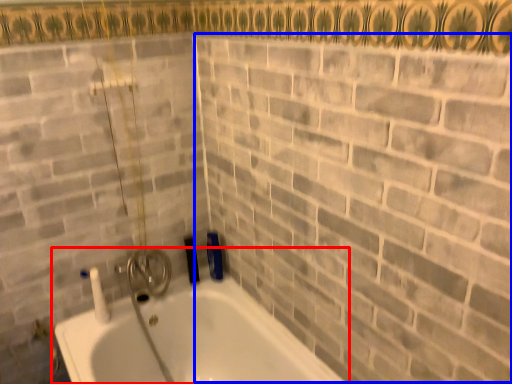
Question: Which object appears farthest to the camera in this image, bathtub (highlighted by a red box) or brick (highlighted by a blue box)?

Choices:
 (A) bathtub
 (B) brick

Answer: (A)